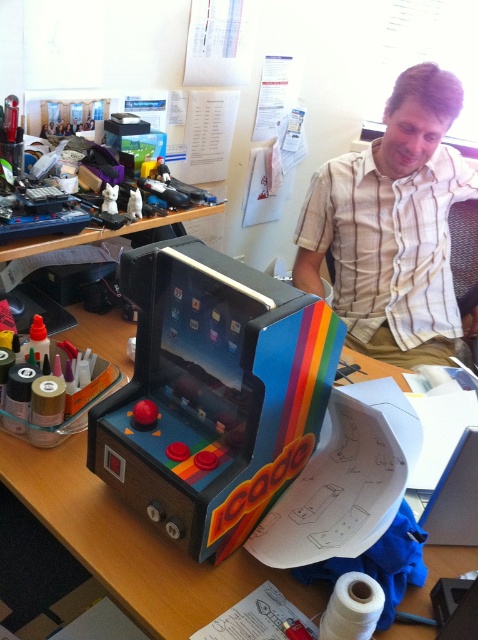
You are organizing items on a desk and need to place a new item between the rainbow painted arcade cabinet at center and the rubberized plastic toy at center. Which object should you place the new item closer to if you want it to be nearer to the viewer?

The rainbow painted arcade cabinet at center is closer to the viewer than the rubberized plastic toy at center, so placing the new item closer to the rainbow painted arcade cabinet at center will make it nearer to the viewer.